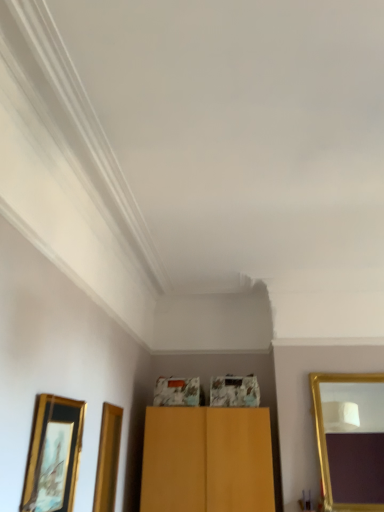
Question: Is gold-framed mirror at right not close to gold-framed picture at lower left?

Choices:
 (A) no
 (B) yes

Answer: (B)

Question: Can you confirm if gold-framed mirror at right is wider than gold-framed picture at lower left?

Choices:
 (A) yes
 (B) no

Answer: (A)

Question: Is gold-framed mirror at right at the right side of gold-framed picture at lower left?

Choices:
 (A) no
 (B) yes

Answer: (B)

Question: Is gold-framed mirror at right smaller than gold-framed picture at lower left?

Choices:
 (A) no
 (B) yes

Answer: (A)

Question: Is the depth of gold-framed mirror at right greater than that of gold-framed picture at lower left?

Choices:
 (A) yes
 (B) no

Answer: (A)

Question: From a real-world perspective, does gold-framed mirror at right stand above gold-framed picture at lower left?

Choices:
 (A) no
 (B) yes

Answer: (B)

Question: Considering the relative sizes of gold-framed picture at lower left and gold-framed mirror at right in the image provided, is gold-framed picture at lower left thinner than gold-framed mirror at right?

Choices:
 (A) no
 (B) yes

Answer: (B)

Question: Are gold-framed picture at lower left and gold-framed mirror at right beside each other?

Choices:
 (A) no
 (B) yes

Answer: (A)

Question: Is gold-framed picture at lower left shorter than gold-framed mirror at right?

Choices:
 (A) no
 (B) yes

Answer: (B)

Question: Does gold-framed picture at lower left come behind gold-framed mirror at right?

Choices:
 (A) yes
 (B) no

Answer: (B)

Question: Does gold-framed picture at lower left have a larger size compared to gold-framed mirror at right?

Choices:
 (A) no
 (B) yes

Answer: (A)

Question: Considering the relative sizes of gold-framed picture at lower left and gold-framed mirror at right in the image provided, is gold-framed picture at lower left smaller than gold-framed mirror at right?

Choices:
 (A) no
 (B) yes

Answer: (B)

Question: Is gold-framed picture at lower left in front of or behind gold-framed mirror at right in the image?

Choices:
 (A) behind
 (B) front

Answer: (B)